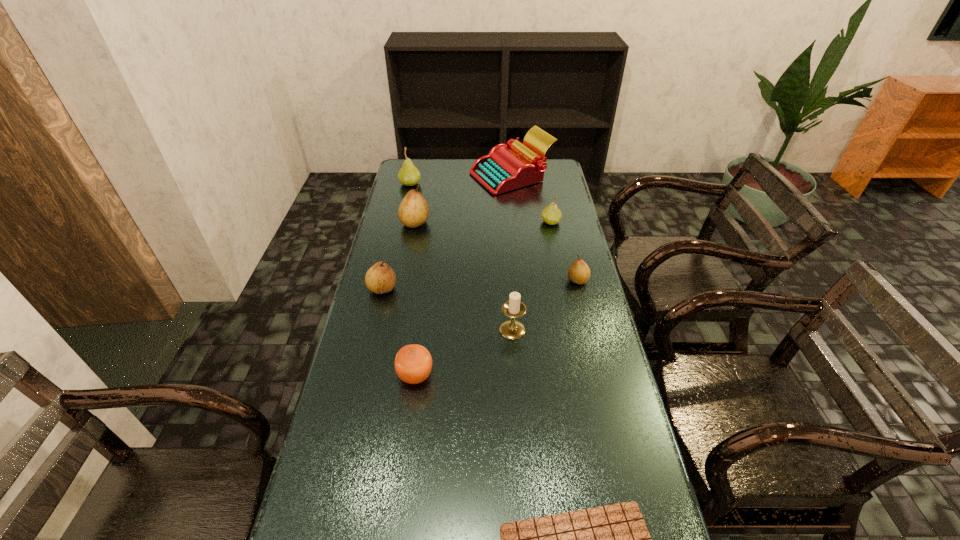
Identify which object is the eighth closest to the biggest brown pear. Please provide its 2D coordinates. Your answer should be formatted as a tuple, i.e. [(x, y)], where the tuple contains the x and y coordinates of a point satisfying the conditions above.

[(613, 539)]

At what (x,y) coordinates should I click in order to perform the action: click on pear identified as the third closest to the nearest object. Please return your answer as a coordinate pair (x, y). The image size is (960, 540). Looking at the image, I should click on (413, 211).

Choose which pear is the third nearest neighbor to the orange orange. Please provide its 2D coordinates. Your answer should be formatted as a tuple, i.e. [(x, y)], where the tuple contains the x and y coordinates of a point satisfying the conditions above.

[(413, 211)]

Locate which brown pear ranks second in proximity to the candle holder. Please provide its 2D coordinates. Your answer should be formatted as a tuple, i.e. [(x, y)], where the tuple contains the x and y coordinates of a point satisfying the conditions above.

[(380, 278)]

Where is `brown pear that stands as the closest to the typewriter`? The image size is (960, 540). brown pear that stands as the closest to the typewriter is located at coordinates (413, 211).

Find the location of `green pear that stands as the second closest to the typewriter`. green pear that stands as the second closest to the typewriter is located at coordinates (409, 175).

Select which green pear appears as the second closest to the orange. Please provide its 2D coordinates. Your answer should be formatted as a tuple, i.e. [(x, y)], where the tuple contains the x and y coordinates of a point satisfying the conditions above.

[(409, 175)]

This screenshot has height=540, width=960. In order to click on free location that satisfies the following two spatial constraints: 1. on the back side of the rightmost brown pear; 2. on the left side of the white candle holder in this screenshot , I will do `click(509, 280)`.

At what (x,y) coordinates should I click in order to perform the action: click on blank area in the image that satisfies the following two spatial constraints: 1. on the typing side of the smallest brown pear; 2. on the left side of the typewriter. Please return your answer as a coordinate pair (x, y). Looking at the image, I should click on (522, 280).

The image size is (960, 540). What are the coordinates of `free space that satisfies the following two spatial constraints: 1. on the back side of the smallest brown pear; 2. on the typing side of the typewriter` in the screenshot? It's located at (552, 176).